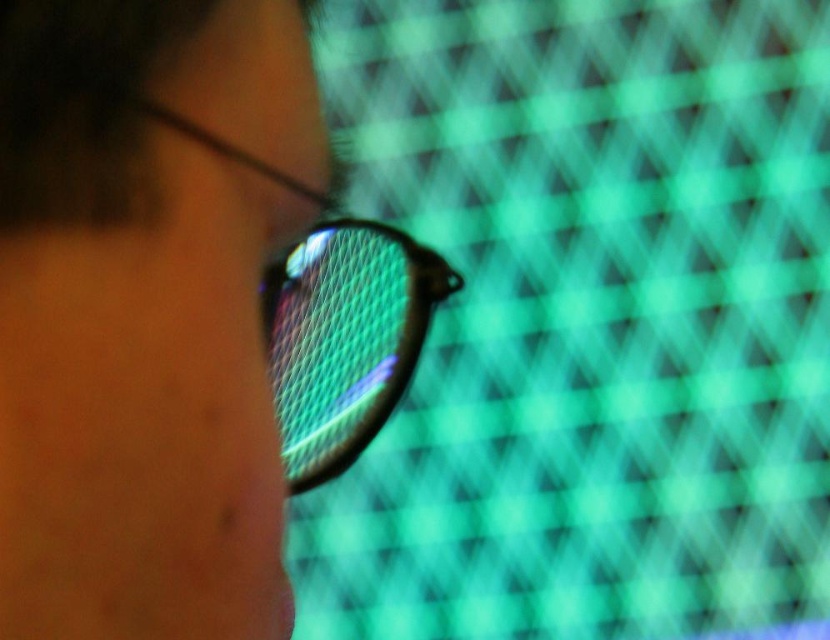
You are a tennis coach observing a player holding a racket. You notice a point marked at coordinates (x=344, y=339). Can you determine if the racket is positioned at the center of the image based on this point?

Yes, the racket is positioned at the center of the image because the point (x=344, y=339) marks the mesh patterned racket at center.